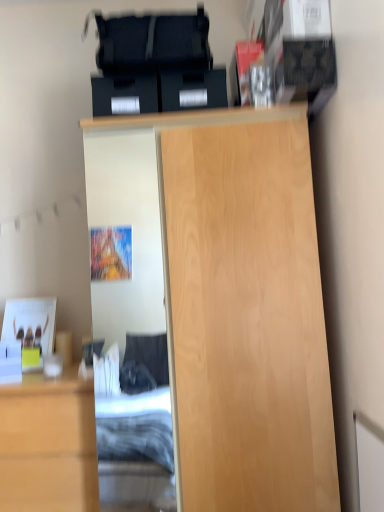
You are a GUI agent. You are given a task and a screenshot of the screen. Output one action in this format:
    pyautogui.click(x=<x>, y=<y>)
    Task: Click on the light wood cupboard at center
    
    Given the screenshot: What is the action you would take?
    pyautogui.click(x=243, y=309)

What do you see at coordinates (243, 309) in the screenshot? I see `light wood cupboard at center` at bounding box center [243, 309].

This screenshot has height=512, width=384. Describe the element at coordinates (48, 445) in the screenshot. I see `light wood cabinet at lower left` at that location.

The image size is (384, 512). I want to click on light wood cabinet at lower left, so click(48, 445).

At what (x,y) coordinates should I click in order to perform the action: click on light wood cupboard at center. Please return your answer as a coordinate pair (x, y). Image resolution: width=384 pixels, height=512 pixels. Looking at the image, I should click on (243, 309).

Is light wood cupboard at center to the left of light wood cabinet at lower left from the viewer's perspective?

Incorrect, light wood cupboard at center is not on the left side of light wood cabinet at lower left.

In the image, is light wood cupboard at center positioned in front of or behind light wood cabinet at lower left?

light wood cupboard at center is positioned closer to the viewer than light wood cabinet at lower left.

Which point is more distant from viewer, (241, 139) or (15, 421)?

The point (15, 421) is farther from the camera.

From the image's perspective, is light wood cupboard at center located beneath light wood cabinet at lower left?

Actually, light wood cupboard at center appears above light wood cabinet at lower left in the image.

From a real-world perspective, which is physically below, light wood cupboard at center or light wood cabinet at lower left?

light wood cabinet at lower left, from a real-world perspective.

Does light wood cupboard at center have a greater width compared to light wood cabinet at lower left?

Yes.

Looking at this image, considering the relative sizes of light wood cupboard at center and light wood cabinet at lower left in the image provided, is light wood cupboard at center taller than light wood cabinet at lower left?

Yes.

Which of these two, light wood cupboard at center or light wood cabinet at lower left, is bigger?

Bigger between the two is light wood cupboard at center.

Is light wood cabinet at lower left inside light wood cupboard at center?

No, light wood cabinet at lower left is located outside of light wood cupboard at center.

Are light wood cupboard at center and light wood cabinet at lower left beside each other?

light wood cupboard at center and light wood cabinet at lower left are clearly separated.

Is light wood cupboard at center turned away from light wood cabinet at lower left?

No, light wood cupboard at center's orientation is not away from light wood cabinet at lower left.

At what (x,y) coordinates should I click in order to perform the action: click on cabinetry beneath the light wood cupboard at center (from a real-world perspective). Please return your answer as a coordinate pair (x, y). This screenshot has height=512, width=384. Looking at the image, I should click on (48, 445).

Which object is positioned more to the right, light wood cabinet at lower left or light wood cupboard at center?

Positioned to the right is light wood cupboard at center.

Looking at this image, which object is closer to the camera, light wood cabinet at lower left or light wood cupboard at center?

Positioned in front is light wood cupboard at center.

Is point (77, 424) closer or farther from the camera than point (247, 320)?

Point (77, 424) is farther from the camera than point (247, 320).

From the image's perspective, which object appears higher, light wood cabinet at lower left or light wood cupboard at center?

light wood cupboard at center appears higher in the image.

From a real-world perspective, who is located higher, light wood cabinet at lower left or light wood cupboard at center?

light wood cupboard at center.

Considering the sizes of light wood cabinet at lower left and light wood cupboard at center in the image, is light wood cabinet at lower left wider or thinner than light wood cupboard at center?

Clearly, light wood cabinet at lower left has less width compared to light wood cupboard at center.

Is light wood cabinet at lower left shorter than light wood cupboard at center?

Indeed, light wood cabinet at lower left has a lesser height compared to light wood cupboard at center.

Based on their sizes in the image, would you say light wood cabinet at lower left is bigger or smaller than light wood cupboard at center?

light wood cabinet at lower left is smaller than light wood cupboard at center.

Could light wood cupboard at center be considered to be inside light wood cabinet at lower left?

No.

Are light wood cabinet at lower left and light wood cupboard at center far apart?

No, there isn't a large distance between light wood cabinet at lower left and light wood cupboard at center.

Is light wood cupboard at center at the back of light wood cabinet at lower left?

No.

How many degrees apart are the facing directions of light wood cabinet at lower left and light wood cupboard at center?

There is a 1.23-degree angle between the facing directions of light wood cabinet at lower left and light wood cupboard at center.

Measure the distance from light wood cabinet at lower left to light wood cupboard at center.

light wood cabinet at lower left and light wood cupboard at center are 63.51 centimeters apart from each other.

At what (x,y) coordinates should I click in order to perform the action: click on cupboard in front of the light wood cabinet at lower left. Please return your answer as a coordinate pair (x, y). The width and height of the screenshot is (384, 512). Looking at the image, I should click on (243, 309).

Identify the location of cabinetry that appears on the left of light wood cupboard at center. (48, 445).

I want to click on cabinetry below the light wood cupboard at center (from the image's perspective), so click(48, 445).